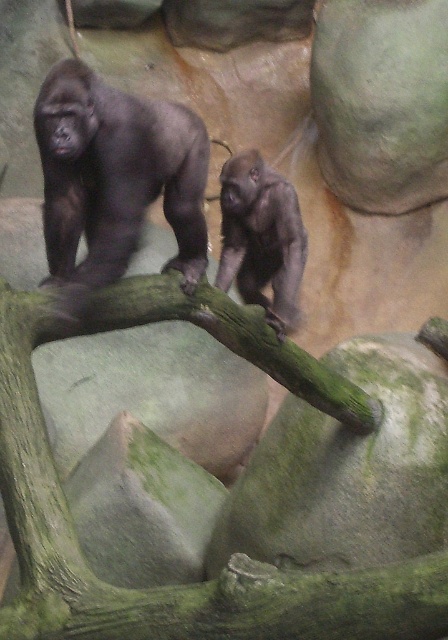
Consider the image. You are a zookeeper observing the gorillas in their enclosure. You need to place a banana at a specific location to encourage interaction between the two gorillas. The point you must use is point (176, 586). What object is located at this point?

The point (176, 586) marks the green rough branch at center.

You are a zookeeper observing the enclosure. You notice the green rough branch at center and the shiny dark gray gorilla at center. Which object is closer to you from your vantage point?

The green rough branch at center is closer to you than the shiny dark gray gorilla at center because it is positioned in front of it.

You are a zookeeper observing the enclosure. You notice the green rough branch at center and the gray matte gorilla at center. Which object is closer to you from your vantage point?

The green rough branch at center is closer to you because it is in front of the gray matte gorilla at center.